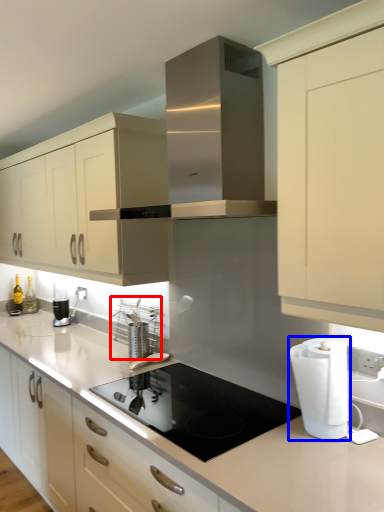
Question: Which of the following is the closest to the observer, appliance (highlighted by a red box) or paper towel (highlighted by a blue box)?

Choices:
 (A) appliance
 (B) paper towel

Answer: (B)